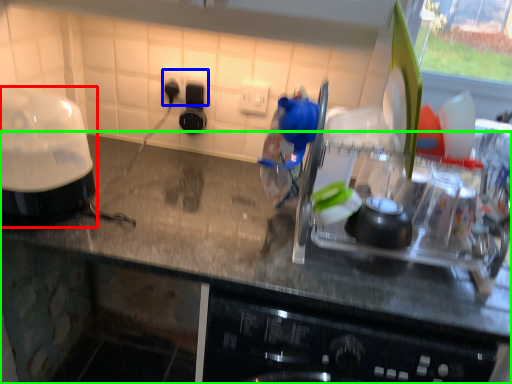
Question: Which object is the closest to the home appliance (highlighted by a red box)? Choose among these: electric outlet (highlighted by a blue box) or countertop (highlighted by a green box).

Choices:
 (A) electric outlet
 (B) countertop

Answer: (B)